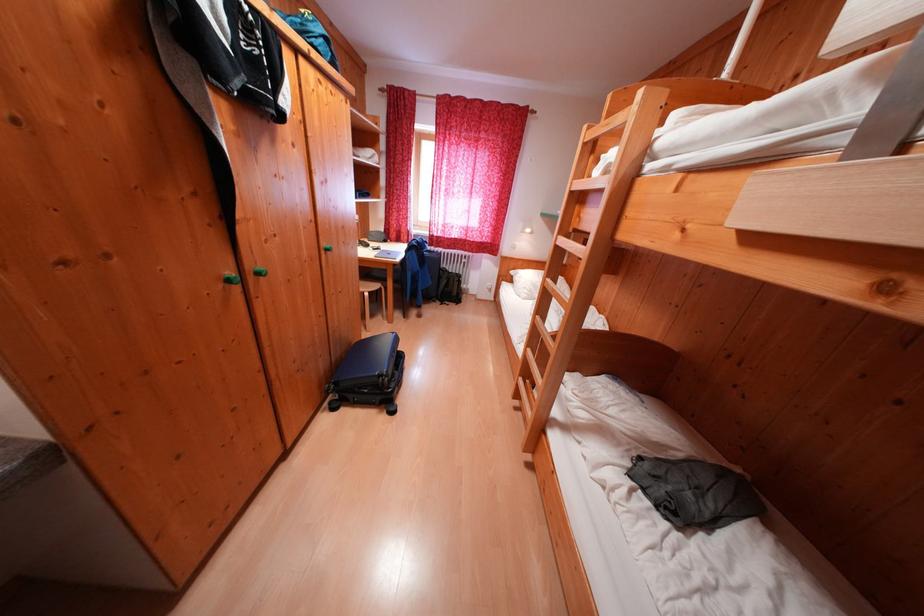
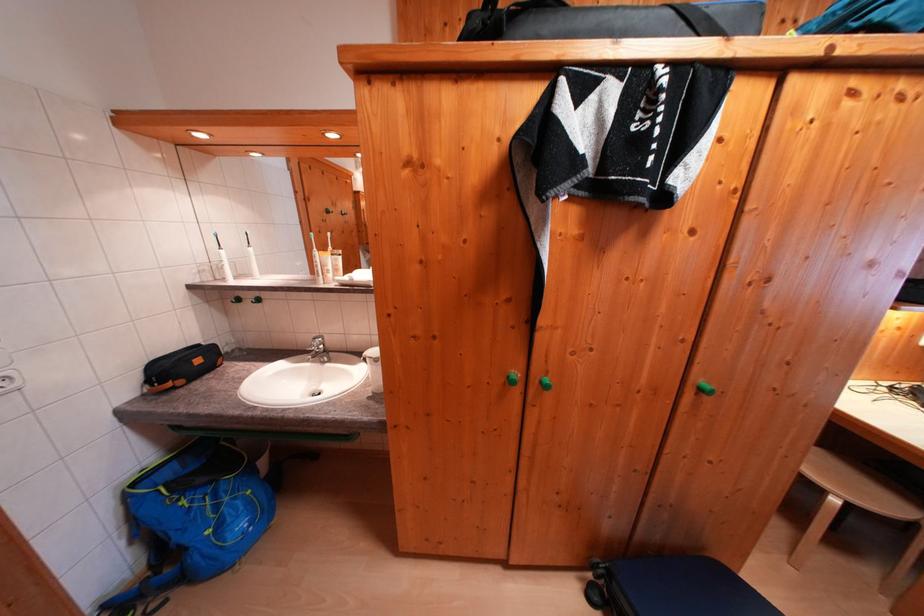
Question: The camera is either moving clockwise (left) or counter-clockwise (right) around the object. The first image is from the beginning of the video and the second image is from the end. Is the camera moving left or right when shooting the video?

Choices:
 (A) Left
 (B) Right

Answer: (B)